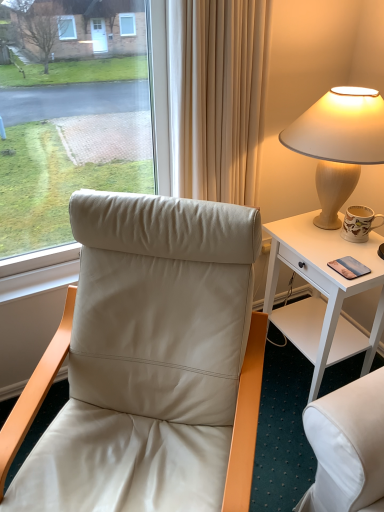
Question: From the image's perspective, would you say leather at left is shown under matte ceramic mug at right?

Choices:
 (A) yes
 (B) no

Answer: (A)

Question: Is leather at left oriented towards matte ceramic mug at right?

Choices:
 (A) no
 (B) yes

Answer: (A)

Question: Does leather at left have a larger size compared to matte ceramic mug at right?

Choices:
 (A) yes
 (B) no

Answer: (A)

Question: Is leather at left behind matte ceramic mug at right?

Choices:
 (A) yes
 (B) no

Answer: (B)

Question: Is leather at left turned away from matte ceramic mug at right?

Choices:
 (A) yes
 (B) no

Answer: (B)

Question: Is leather at left far away from matte ceramic mug at right?

Choices:
 (A) yes
 (B) no

Answer: (B)

Question: Is white wood desk at right wider than leather at left?

Choices:
 (A) yes
 (B) no

Answer: (B)

Question: Is white wood desk at right facing towards leather at left?

Choices:
 (A) no
 (B) yes

Answer: (B)

Question: From a real-world perspective, is white wood desk at right located beneath leather at left?

Choices:
 (A) no
 (B) yes

Answer: (B)

Question: Is white wood desk at right taller than leather at left?

Choices:
 (A) no
 (B) yes

Answer: (A)

Question: Is white wood desk at right located outside leather at left?

Choices:
 (A) yes
 (B) no

Answer: (A)

Question: Is white wood desk at right smaller than leather at left?

Choices:
 (A) yes
 (B) no

Answer: (A)

Question: Can you confirm if white wood desk at right is taller than matte beige lamp at upper right?

Choices:
 (A) yes
 (B) no

Answer: (A)